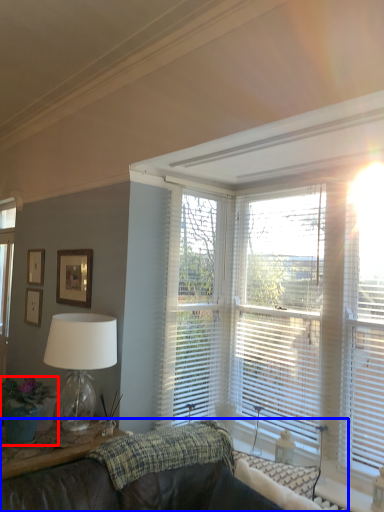
Question: Which object appears farthest to the camera in this image, houseplant (highlighted by a red box) or studio couch (highlighted by a blue box)?

Choices:
 (A) houseplant
 (B) studio couch

Answer: (A)